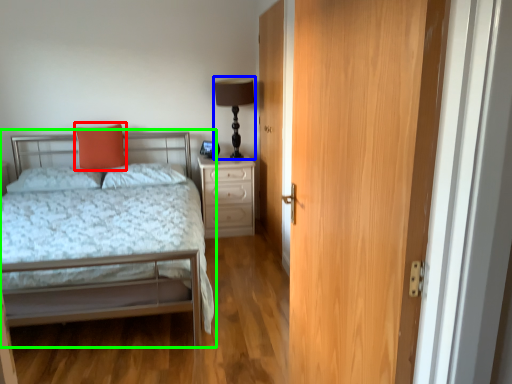
Question: Which object is the closest to the throw pillow (highlighted by a red box)? Choose among these: table lamp (highlighted by a blue box) or bed (highlighted by a green box).

Choices:
 (A) table lamp
 (B) bed

Answer: (B)